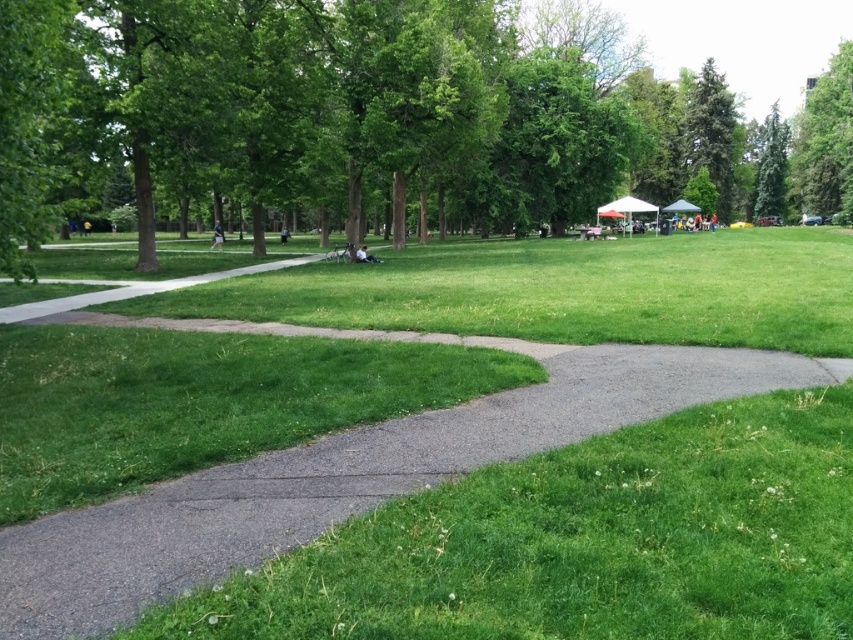
Question: Estimate the real-world distances between objects in this image. Which object is closer to the green textured tree at upper right?

Choices:
 (A) white canopy at upper right
 (B) green leafy tree at upper right

Answer: (B)

Question: Among these objects, which one is nearest to the camera?

Choices:
 (A) white canopy at upper right
 (B) green fir tree at upper right
 (C) green leafy tree at upper right
 (D) green grass at center

Answer: (D)

Question: Is green grass at center positioned in front of green textured tree at upper right?

Choices:
 (A) yes
 (B) no

Answer: (A)

Question: Where is green grass at center located in relation to green fir tree at upper right in the image?

Choices:
 (A) right
 (B) left

Answer: (B)

Question: Can you confirm if green leafy tree at center is positioned to the left of white canopy at upper right?

Choices:
 (A) no
 (B) yes

Answer: (A)

Question: Which of the following is the farthest from the observer?

Choices:
 (A) (612, 200)
 (B) (514, 148)
 (C) (769, 141)
 (D) (837, 70)

Answer: (C)